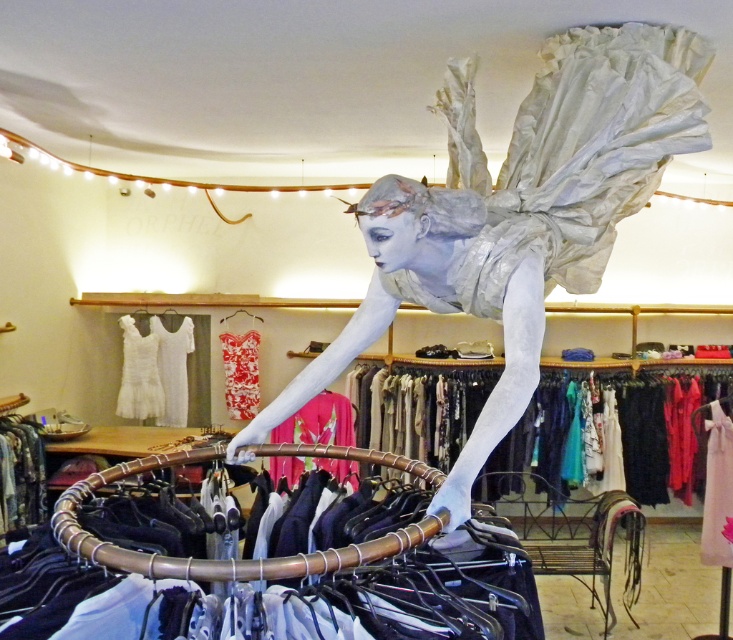
Does pink satin blouse at center have a larger size compared to floral fabric dress at lower left?

Correct, pink satin blouse at center is larger in size than floral fabric dress at lower left.

Between pink satin blouse at center and floral fabric dress at lower left, which one is positioned lower?

floral fabric dress at lower left

Does point (320, 433) lie behind point (7, 480)?

Yes, point (320, 433) is behind point (7, 480).

Identify the location of pink satin blouse at center. The width and height of the screenshot is (733, 640). (317, 422).

Does floral fabric dress at lower left appear on the right side of white lace dress at left?

In fact, floral fabric dress at lower left is to the left of white lace dress at left.

Measure the distance between floral fabric dress at lower left and camera.

floral fabric dress at lower left is 12.20 feet away from camera.

Which is behind, point (7, 516) or point (132, 408)?

Positioned behind is point (132, 408).

Find the location of a particular element. This screenshot has height=640, width=733. floral fabric dress at lower left is located at coordinates (21, 474).

Who is positioned more to the right, silky black dress at center or white lace dress at center?

silky black dress at center is more to the right.

I want to click on silky black dress at center, so click(x=567, y=436).

This screenshot has height=640, width=733. Describe the element at coordinates (567, 436) in the screenshot. I see `silky black dress at center` at that location.

This screenshot has width=733, height=640. Identify the location of silky black dress at center. point(567,436).